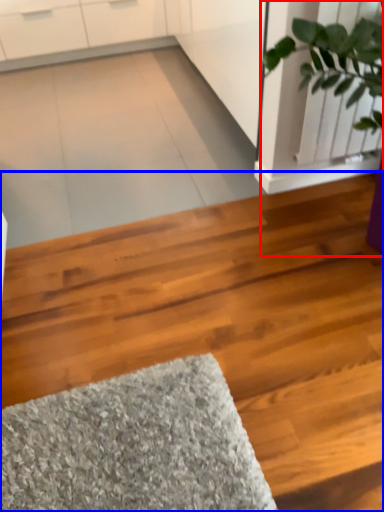
Question: Among these objects, which one is nearest to the camera, houseplant (highlighted by a red box) or hardwood (highlighted by a blue box)?

Choices:
 (A) houseplant
 (B) hardwood

Answer: (B)